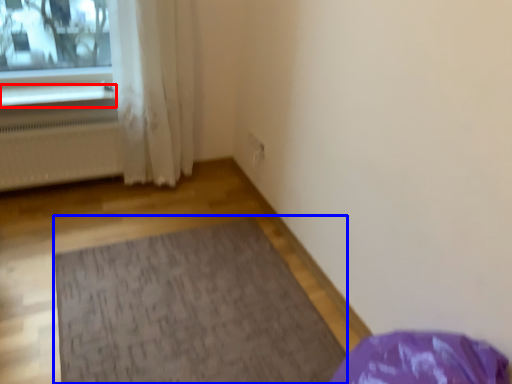
Question: Which point is further to the camera, window sill (highlighted by a red box) or mat (highlighted by a blue box)?

Choices:
 (A) window sill
 (B) mat

Answer: (A)